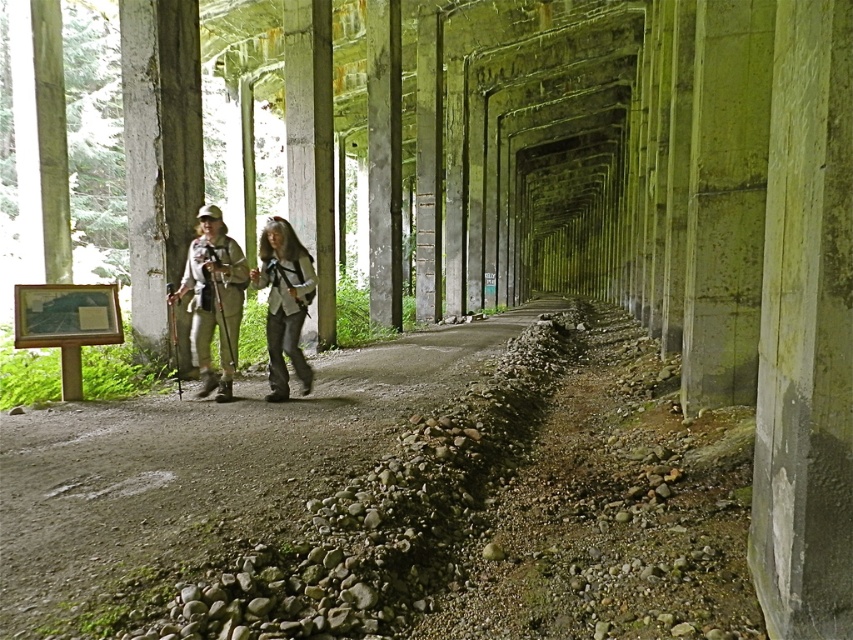
The width and height of the screenshot is (853, 640). Describe the element at coordinates (242, 298) in the screenshot. I see `matte khaki pants at center` at that location.

Which of these two, matte khaki pants at center or gray fabric backpack at center, stands taller?

matte khaki pants at center

The image size is (853, 640). What are the coordinates of `matte khaki pants at center` in the screenshot? It's located at (242, 298).